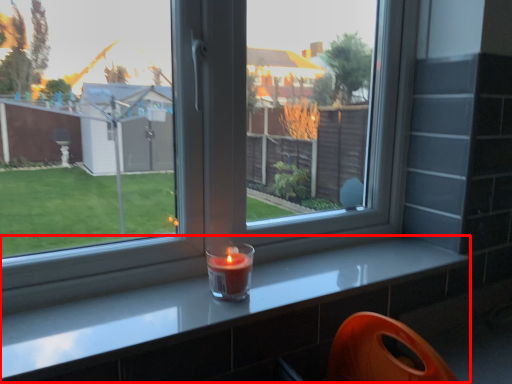
Question: Considering the relative positions of counter (annotated by the red box) and candle holder in the image provided, where is counter (annotated by the red box) located with respect to the staircase?

Choices:
 (A) right
 (B) left

Answer: (A)